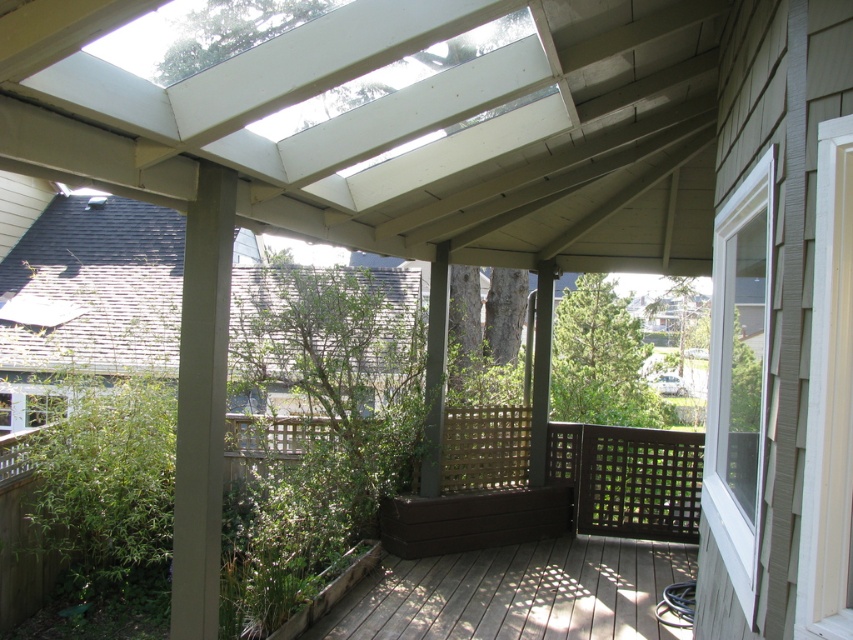
You are standing on the brown wood deck at lower center and want to look through the white plastic window at right. Can you see over the edge of the deck to the window?

The brown wood deck at lower center has a lesser height compared to white plastic window at right, so you can see over the edge of the deck to the window.

You are standing on the deck and want to know the exact location of the white plastic window at right. Can you provide its coordinates?

The white plastic window at right is located at coordinates point (740, 378).

You are a delivery person standing at the entrance of the deck. You need to place a package on the deck. The package requires a flat surface that is at least 2 meters away from you. Can you place the package on the white plastic window at right?

The white plastic window at right is 2.14 meters from the camera, so yes, the package can be placed there as it meets the minimum distance requirement.